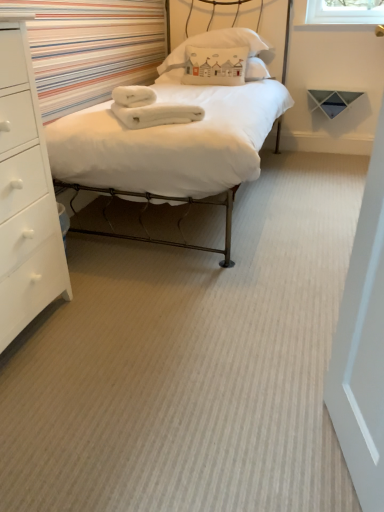
Question: Do you think white soft bed at center is within white cotton pillow at upper center, or outside of it?

Choices:
 (A) inside
 (B) outside

Answer: (B)

Question: In terms of size, does white soft bed at center appear bigger or smaller than white cotton pillow at upper center?

Choices:
 (A) small
 (B) big

Answer: (B)

Question: Which of these objects is positioned closest to the white fluffy towels at center?

Choices:
 (A) white soft bed at center
 (B) white cotton pillow at upper center
 (C) white matte chest of drawers at left

Answer: (A)

Question: Based on their relative distances, which object is farther from the white cotton pillow at upper center?

Choices:
 (A) white soft bed at center
 (B) white matte chest of drawers at left
 (C) white fluffy towels at center

Answer: (B)